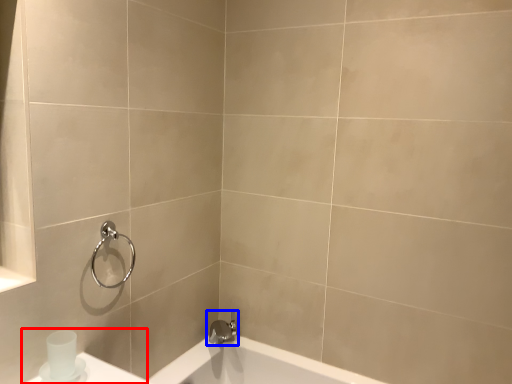
Question: Which object is further to the camera taking this photo, sink (highlighted by a red box) or tap (highlighted by a blue box)?

Choices:
 (A) sink
 (B) tap

Answer: (B)